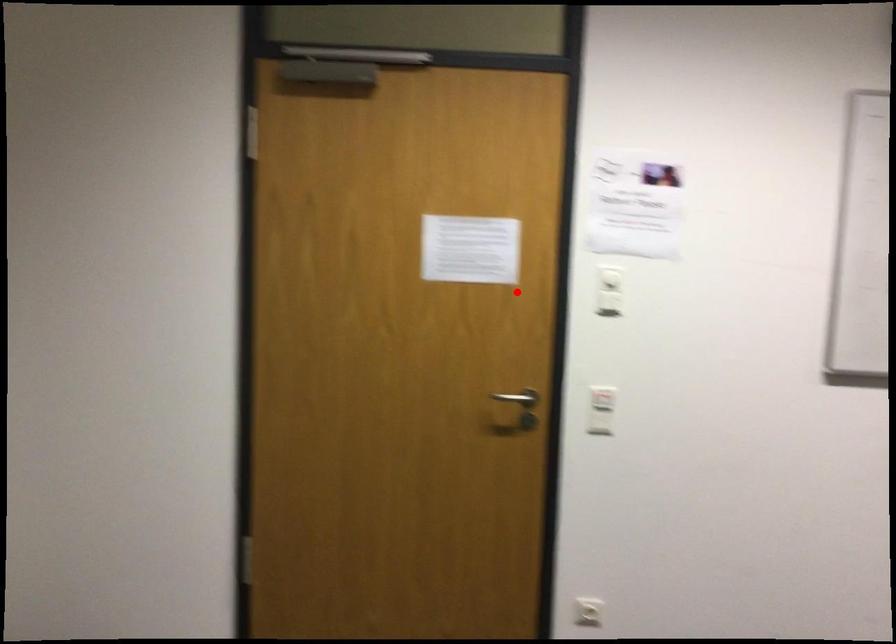
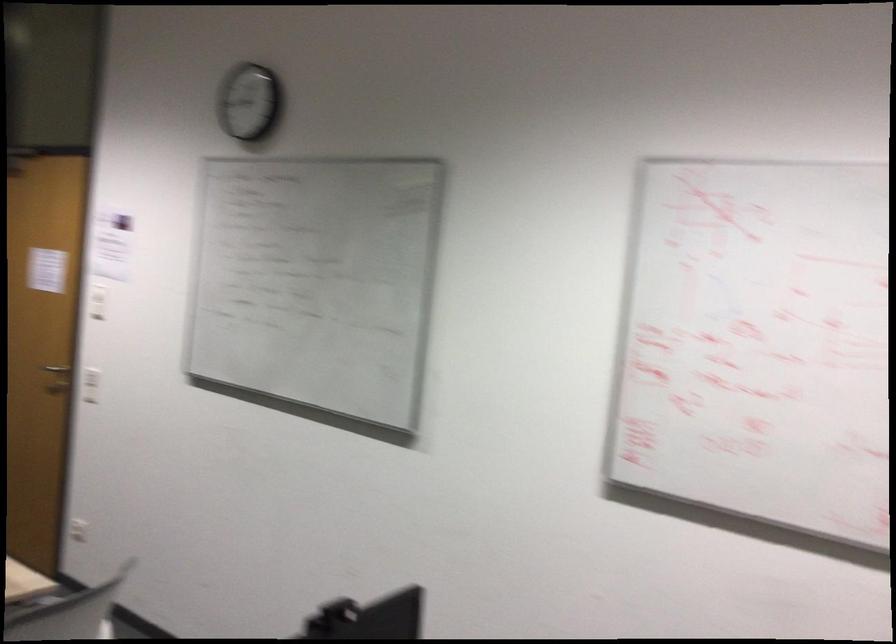
Locate, in the second image, the point that corresponds to the highlighted location in the first image.

(97, 301)